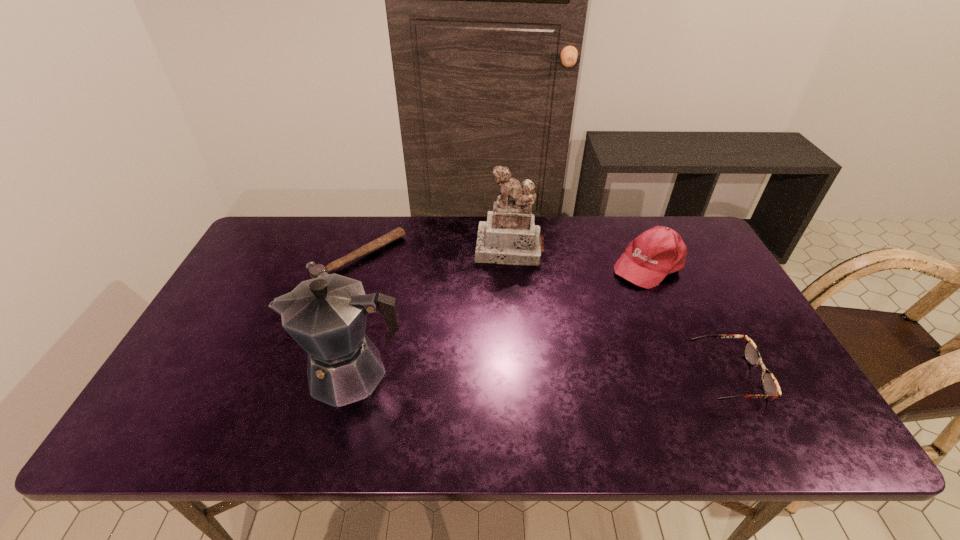
This screenshot has width=960, height=540. I want to click on free space that is in between the spectacles and the third shortest object, so click(687, 320).

Find the location of a particular element. vacant space that is in between the third object from right to left and the baseball cap is located at coordinates (578, 256).

Where is `vacant area that lies between the figurine and the spectacles`? The width and height of the screenshot is (960, 540). vacant area that lies between the figurine and the spectacles is located at coordinates (619, 313).

Locate an element on the screen. The image size is (960, 540). unoccupied position between the spectacles and the shortest object is located at coordinates (542, 318).

Find the location of a particular element. empty space between the second shortest object and the baseball cap is located at coordinates (687, 320).

Identify the location of vacant space in between the second shortest object and the hammer. This screenshot has height=540, width=960. (542, 318).

The width and height of the screenshot is (960, 540). I want to click on free point between the third object from left to right and the spectacles, so click(619, 313).

Identify which object is the nearest to the figurine. Please provide its 2D coordinates. Your answer should be formatted as a tuple, i.e. [(x, y)], where the tuple contains the x and y coordinates of a point satisfying the conditions above.

[(649, 258)]

Where is `object that is the third closest to the baseball cap`? This screenshot has height=540, width=960. object that is the third closest to the baseball cap is located at coordinates (326, 316).

Locate an element on the screen. This screenshot has height=540, width=960. free space that satisfies the following two spatial constraints: 1. on the front side of the hammer; 2. on the frame of the spectacles is located at coordinates (321, 376).